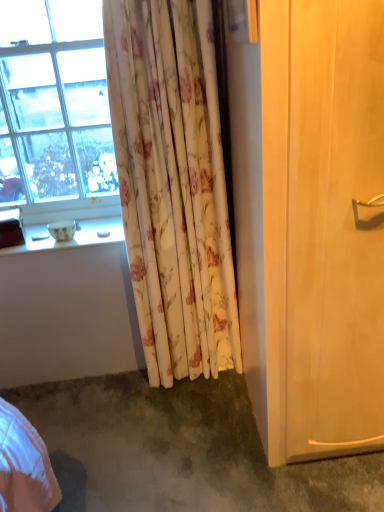
Question: Does transparent glass window at upper left contain light wood screen door at right?

Choices:
 (A) no
 (B) yes

Answer: (A)

Question: Is transparent glass window at upper left far from light wood screen door at right?

Choices:
 (A) no
 (B) yes

Answer: (B)

Question: From a real-world perspective, is transparent glass window at upper left physically below light wood screen door at right?

Choices:
 (A) no
 (B) yes

Answer: (A)

Question: Does transparent glass window at upper left have a greater height compared to light wood screen door at right?

Choices:
 (A) no
 (B) yes

Answer: (A)

Question: Is transparent glass window at upper left wider than light wood screen door at right?

Choices:
 (A) no
 (B) yes

Answer: (A)

Question: From a real-world perspective, relative to transparent glass window at upper left, is light wood screen door at right vertically above or below?

Choices:
 (A) above
 (B) below

Answer: (B)

Question: Considering the positions of light wood screen door at right and transparent glass window at upper left in the image, is light wood screen door at right wider or thinner than transparent glass window at upper left?

Choices:
 (A) thin
 (B) wide

Answer: (B)

Question: From their relative heights in the image, would you say light wood screen door at right is taller or shorter than transparent glass window at upper left?

Choices:
 (A) short
 (B) tall

Answer: (B)

Question: Is light wood screen door at right situated inside transparent glass window at upper left or outside?

Choices:
 (A) outside
 (B) inside

Answer: (A)

Question: From a real-world perspective, is transparent glass window at upper left positioned above or below gray carpet at lower left?

Choices:
 (A) above
 (B) below

Answer: (A)

Question: In the image, is transparent glass window at upper left positioned in front of or behind gray carpet at lower left?

Choices:
 (A) front
 (B) behind

Answer: (B)

Question: In terms of height, does transparent glass window at upper left look taller or shorter compared to gray carpet at lower left?

Choices:
 (A) tall
 (B) short

Answer: (A)

Question: From the image's perspective, is transparent glass window at upper left above or below gray carpet at lower left?

Choices:
 (A) below
 (B) above

Answer: (B)

Question: From the image's perspective, is light wood screen door at right above or below white glossy bowl at lower left?

Choices:
 (A) below
 (B) above

Answer: (A)

Question: Is light wood screen door at right taller or shorter than white glossy bowl at lower left?

Choices:
 (A) short
 (B) tall

Answer: (B)